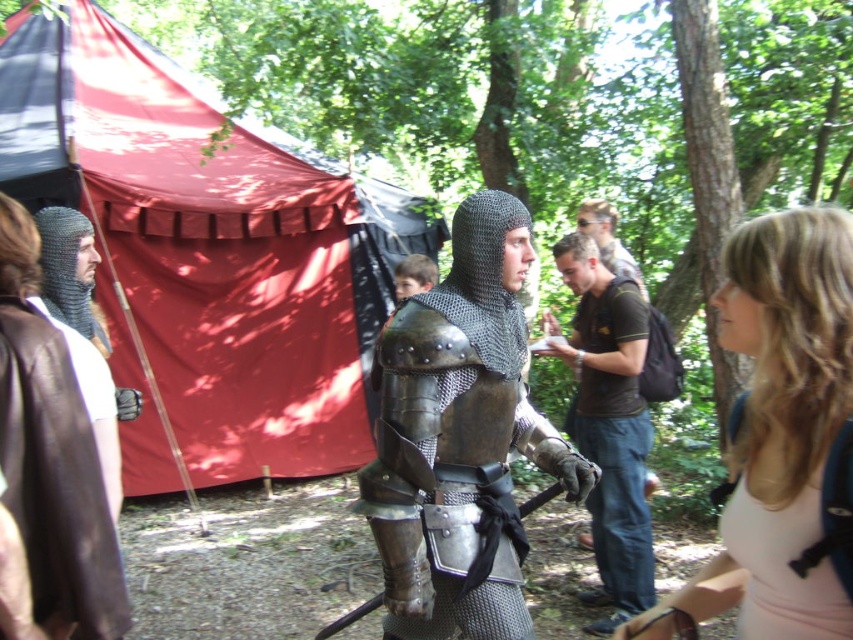
Question: Which of the following is the closest to the observer?

Choices:
 (A) (492, 406)
 (B) (10, 493)

Answer: (B)

Question: Which point is closer to the camera taking this photo?

Choices:
 (A) (374, 515)
 (B) (106, 291)

Answer: (A)

Question: Can you confirm if brown leather shirt at center is wider than pink fabric backpack at lower right?

Choices:
 (A) yes
 (B) no

Answer: (A)

Question: Which object is farther from the camera taking this photo?

Choices:
 (A) metallic chainmail armor at center
 (B) brown leather cape at left
 (C) pink fabric backpack at lower right

Answer: (A)

Question: Is metallic chainmail armor at center to the right of brown leather cape at left from the viewer's perspective?

Choices:
 (A) no
 (B) yes

Answer: (B)

Question: Does metallic chainmail armor at center have a greater width compared to brown leather shirt at center?

Choices:
 (A) yes
 (B) no

Answer: (A)